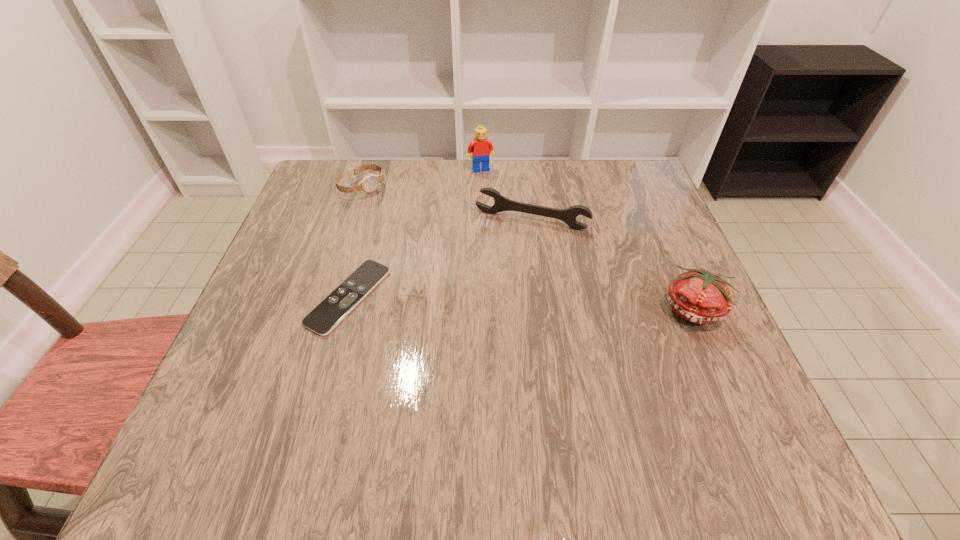
The height and width of the screenshot is (540, 960). I want to click on empty location between the shortest object and the wrench, so click(440, 259).

What are the coordinates of `free space between the farthest object and the rightmost object` in the screenshot? It's located at (588, 240).

Locate an element on the screen. The image size is (960, 540). vacant region between the remote control and the second farthest object is located at coordinates (355, 241).

Find the location of a particular element. The image size is (960, 540). free space between the second farthest object and the fourth shortest object is located at coordinates (528, 248).

Locate which object ranks third in proximity to the Lego. Please provide its 2D coordinates. Your answer should be formatted as a tuple, i.e. [(x, y)], where the tuple contains the x and y coordinates of a point satisfying the conditions above.

[(336, 306)]

Find the location of a particular element. object that stands as the fourth closest to the third shortest object is located at coordinates [370, 182].

Where is `free spot that satisfies the following two spatial constraints: 1. on the back side of the remote control; 2. on the left side of the Lego`? The image size is (960, 540). free spot that satisfies the following two spatial constraints: 1. on the back side of the remote control; 2. on the left side of the Lego is located at coordinates (384, 169).